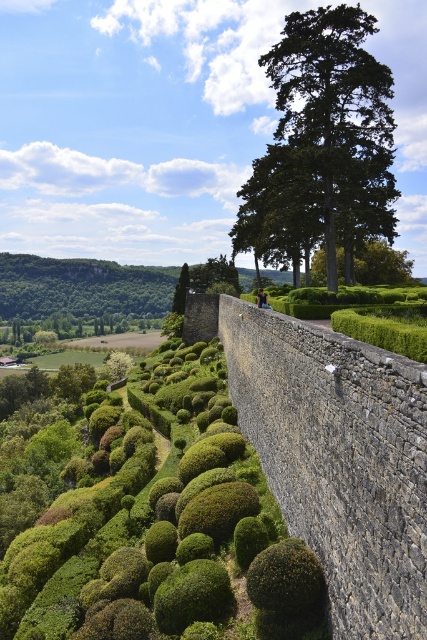
Consider the image. You are standing in the garden and see the point marked at coordinates [324,138]. What object does this point correspond to?

The point at coordinates [324,138] corresponds to the green textured tree at upper center.

You are standing in the garden and want to reach the point marked at coordinates point (x=380, y=246). Given that the garden is 50 meters long, can you safely walk straight to that point without exceeding the garden boundaries?

The point marked at coordinates point (x=380, y=246) is 71.37 meters away from you. Since the garden is only 50 meters long, walking straight to that point would take you beyond the garden boundaries.